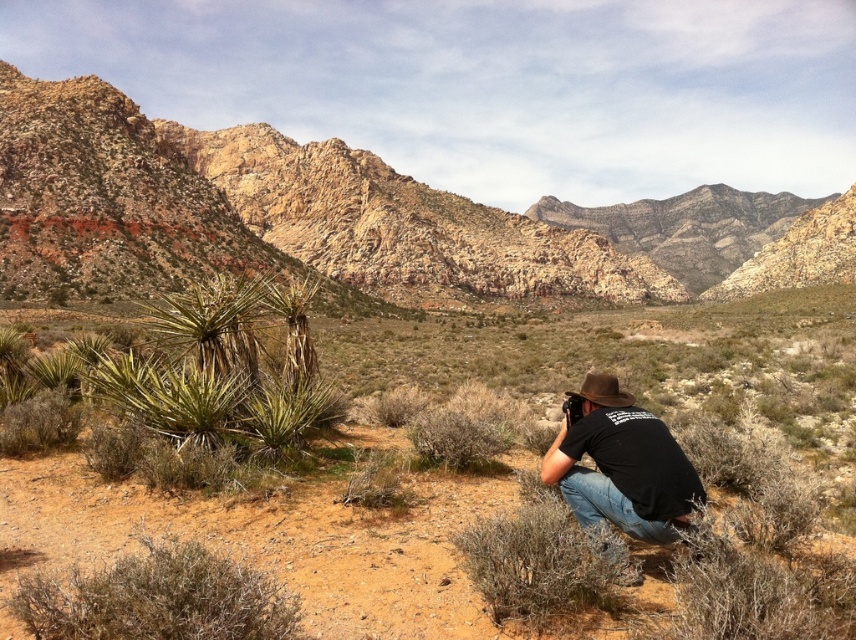
You are a photographer positioned at the bottom of the image and want to capture the green shrubs at center. Based on their coordinates, in which direction should you move your camera to frame them properly?

The green shrubs at center are located at coordinates point (465, 545). Since you are at the bottom of the image, you should move your camera upward to frame them properly.

You are a photographer trying to capture the green shrubs at center and the brown felt cowboy hat at center in the same frame. Given that your camera has a maximum focus range of 15 meters, will you be able to focus on both objects simultaneously?

The distance between the green shrubs at center and the brown felt cowboy hat at center is 14.75 meters, which is within the camera maximum focus range of 15 meters. Therefore, you can focus on both objects simultaneously.